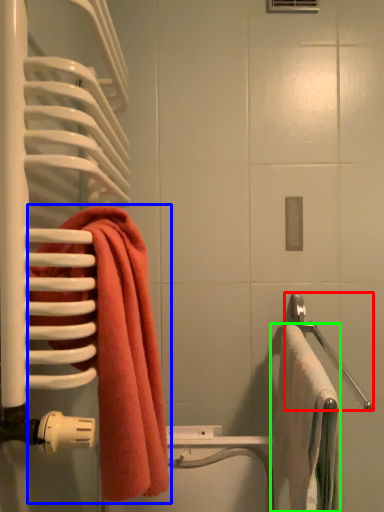
Question: Which object is positioned farthest from towel bar (highlighted by a red box)? Select from towel (highlighted by a blue box) and towel (highlighted by a green box).

Choices:
 (A) towel
 (B) towel

Answer: (A)